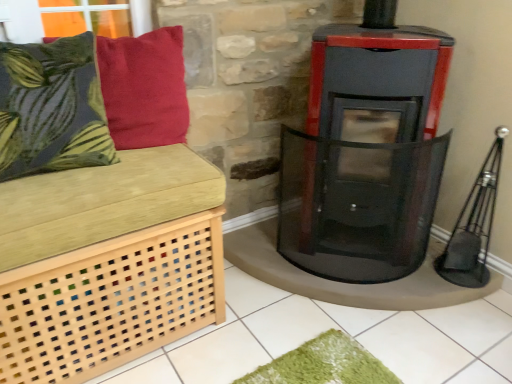
Where is `free spot in front of black glass wood burning stove at center`? The width and height of the screenshot is (512, 384). free spot in front of black glass wood burning stove at center is located at coordinates (333, 340).